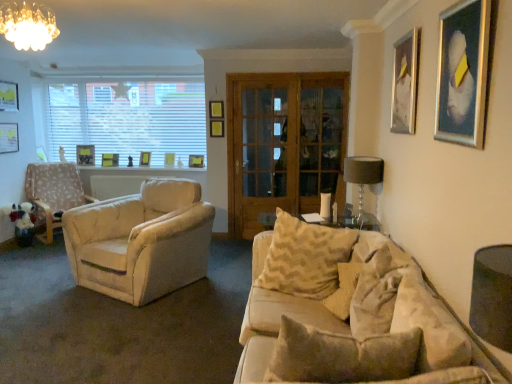
Question: Would you say beige textured pillow at center, the 1th pillow in the back-to-front sequence, is inside or outside matte black picture frame at upper left, which is the 3th picture frame from left to right?

Choices:
 (A) outside
 (B) inside

Answer: (A)

Question: From the image's perspective, is beige textured pillow at center, which ranks as the 3th pillow in front-to-back order, positioned above or below matte black picture frame at upper left, which is counted as the 9th picture frame, starting from the front?

Choices:
 (A) below
 (B) above

Answer: (A)

Question: Considering the real-world distances, which object is farthest from the matte black picture frame at upper left, the 2th picture frame when ordered from left to right?

Choices:
 (A) metallic silver picture frame at upper right, which is the 1th picture frame from right to left
 (B) green matte picture frame at upper center, arranged as the second picture frame when viewed from the back
 (C) beige soft pillow at lower right, acting as the third pillow starting from the back
 (D) matte gold chandelier at upper left
 (E) textured beige pillow at center, the 2th pillow positioned from the back

Answer: (C)

Question: Estimate the real-world distances between objects in this image. Which object is farther from the white blinds at upper left?

Choices:
 (A) metallic silver picture frame at upper right, which is the 8th picture frame in left-to-right order
 (B) textured beige pillow at center, which ranks as the second pillow in front-to-back order
 (C) matte wooden picture frame at center, the 7th picture frame viewed from the front
 (D) metallic silver picture frame at upper right, which is the 1th picture frame from right to left
 (E) matte yellow picture frame at upper center, the fifth picture frame positioned from the back

Answer: (A)